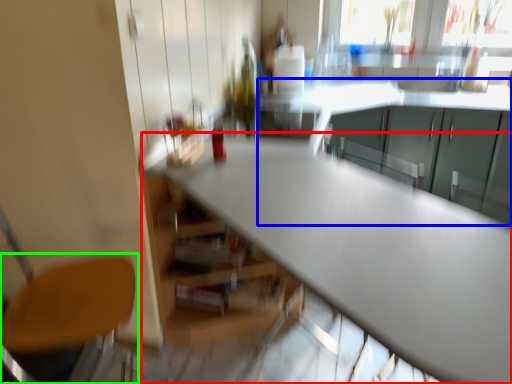
Question: Which is nearer to the table (highlighted by a red box)? cabinetry (highlighted by a blue box) or chair (highlighted by a green box).

Choices:
 (A) cabinetry
 (B) chair

Answer: (B)